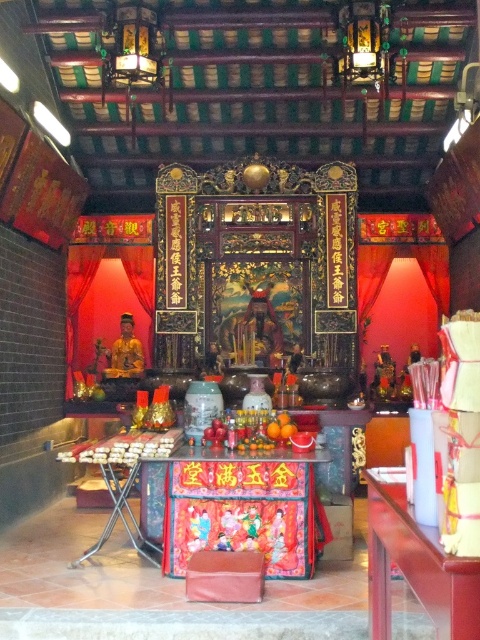
Is colorful fabric altar at center further to the viewer compared to smooth wooden table at center?

Yes, it is.

Where is `colorful fabric altar at center`? colorful fabric altar at center is located at coordinates (235, 508).

I want to click on colorful fabric altar at center, so click(235, 508).

Locate an element on the screen. colorful fabric altar at center is located at coordinates (235, 508).

Where is `colorful fabric altar at center`? This screenshot has height=640, width=480. colorful fabric altar at center is located at coordinates (235, 508).

Looking at this image, which is more to the right, colorful fabric altar at center or velvet-like pink stool at center?

Positioned to the right is colorful fabric altar at center.

Is point (297, 492) in front of point (226, 556)?

No.

Identify the location of colorful fabric altar at center. pos(235,508).

Does smooth wooden table at center appear over velvet-like pink stool at center?

Yes.

Is point (428, 538) behind point (210, 572)?

No, it is in front of (210, 572).

Identify the location of smooth wooden table at center. 415,564.